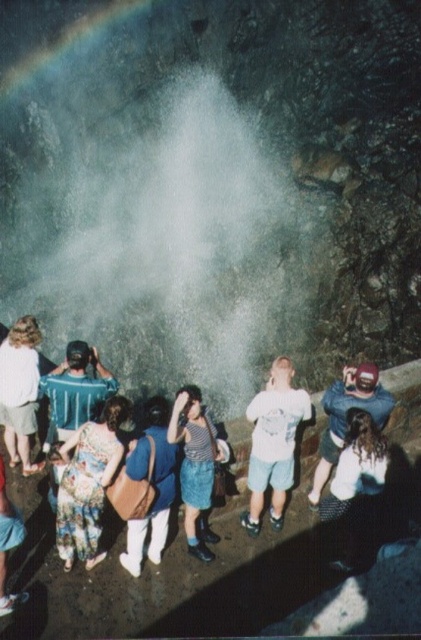
You are standing at the center of the geyser and want to move towards the floral fabric dress at lower left. Which direction should you go?

The floral fabric dress at lower left is located at point [87,483], so you should move towards the lower left direction to reach it.

You are a photographer standing at the camera position. You want to capture a closeup shot of the floral fabric dress at lower left. Can you estimate how far you need to move forward to get within 2 meters of the dress?

The floral fabric dress at lower left is currently 6.52 meters away from the camera. To get within 2 meters, you need to move forward approximately 4.52 meters.